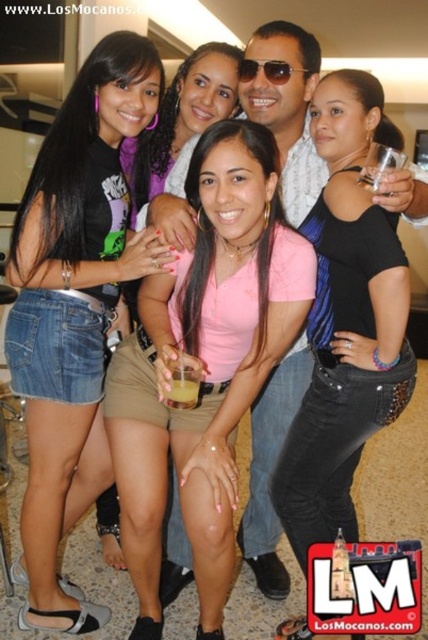
How far apart are black shiny tank top at center and sunglasses at center?

black shiny tank top at center is 27.99 inches from sunglasses at center.

Does black shiny tank top at center appear over sunglasses at center?

Incorrect, black shiny tank top at center is not positioned above sunglasses at center.

Between point (359, 324) and point (246, 61), which one is positioned in front?

Point (359, 324) is more forward.

You are a GUI agent. You are given a task and a screenshot of the screen. Output one action in this format:
    pyautogui.click(x=<x>, y=<y>)
    Task: Click on the black shiny tank top at center
    Image resolution: width=428 pixels, height=640 pixels.
    Given the screenshot: What is the action you would take?
    pyautogui.click(x=345, y=320)

Can you confirm if sunglasses at center is positioned above yellow translucent cup at center?

Yes, sunglasses at center is above yellow translucent cup at center.

Does sunglasses at center have a greater width compared to yellow translucent cup at center?

Yes, sunglasses at center is wider than yellow translucent cup at center.

Which is in front, point (287, 72) or point (171, 397)?

Positioned in front is point (171, 397).

Image resolution: width=428 pixels, height=640 pixels. Identify the location of sunglasses at center. (269, 70).

Is point (148, 236) in front of point (181, 372)?

No, (148, 236) is further to viewer.

Which is in front, point (56, 412) or point (183, 381)?

Point (183, 381) is in front.

The image size is (428, 640). What are the coordinates of `denim shorts at left` in the screenshot? It's located at (74, 307).